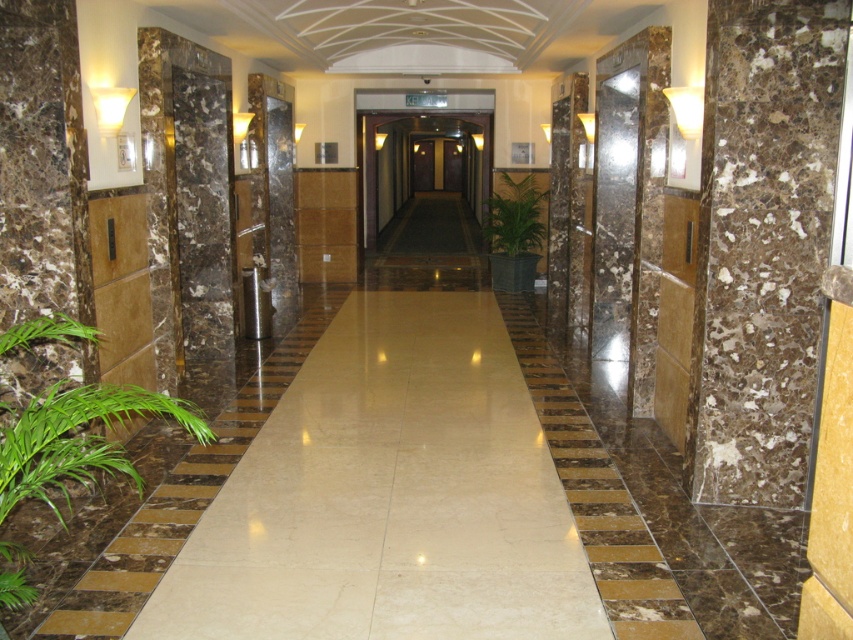
Question: Among these points, which one is farthest from the camera?

Choices:
 (A) (61, 417)
 (B) (527, 248)

Answer: (B)

Question: Which point is closer to the camera?

Choices:
 (A) (175, 403)
 (B) (509, 256)

Answer: (A)

Question: Is green leafy plant at lower left thinner than green leafy plant at center?

Choices:
 (A) no
 (B) yes

Answer: (A)

Question: Considering the relative positions of green leafy plant at lower left and green leafy plant at center in the image provided, where is green leafy plant at lower left located with respect to green leafy plant at center?

Choices:
 (A) left
 (B) right

Answer: (A)

Question: From the image, what is the correct spatial relationship of green leafy plant at lower left in relation to green leafy plant at center?

Choices:
 (A) left
 (B) right

Answer: (A)